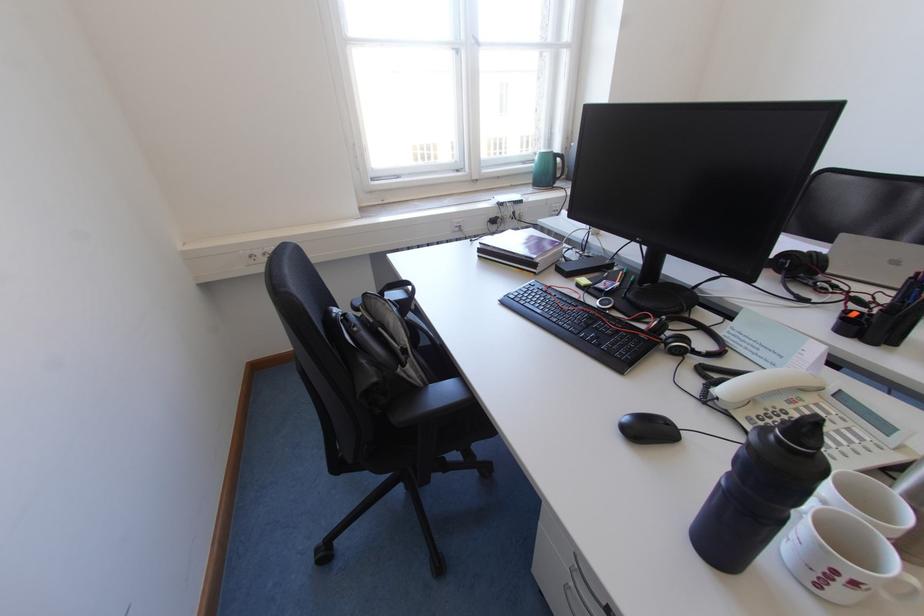
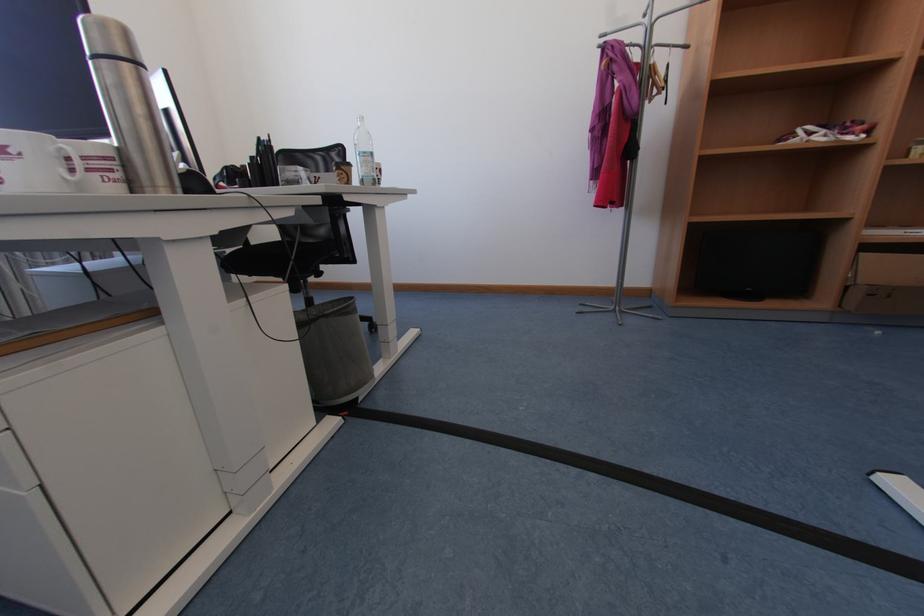
Question: Based on the continuous images, in which direction is the camera rotating? Reply with the corresponding letter.

Choices:
 (A) Left
 (B) Right
 (C) Up
 (D) Down

Answer: (B)